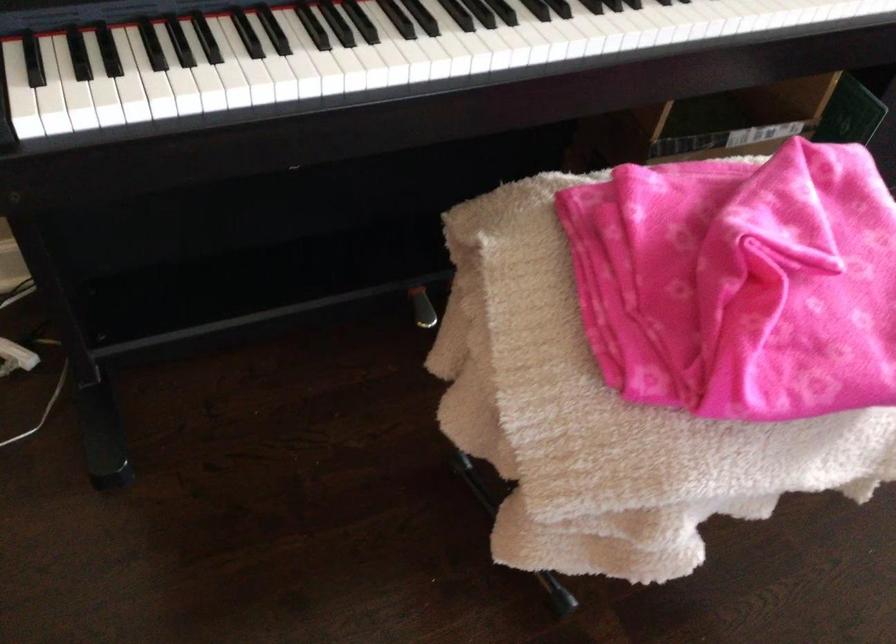
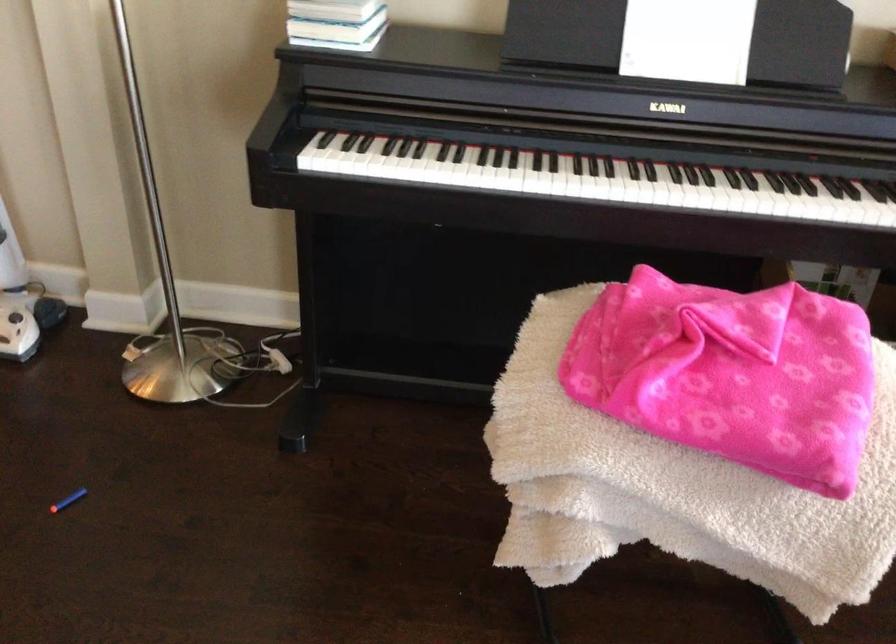
Question: The first image is from the beginning of the video and the second image is from the end. How did the camera likely rotate when shooting the video?

Choices:
 (A) Left
 (B) Right
 (C) Up
 (D) Down

Answer: (A)